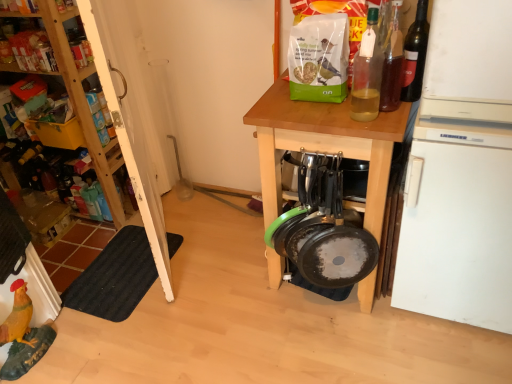
Where is `free space to the left of translucent glass bottle at upper right, which is the second bottle in left-to-right order`? The image size is (512, 384). free space to the left of translucent glass bottle at upper right, which is the second bottle in left-to-right order is located at coordinates coord(331,116).